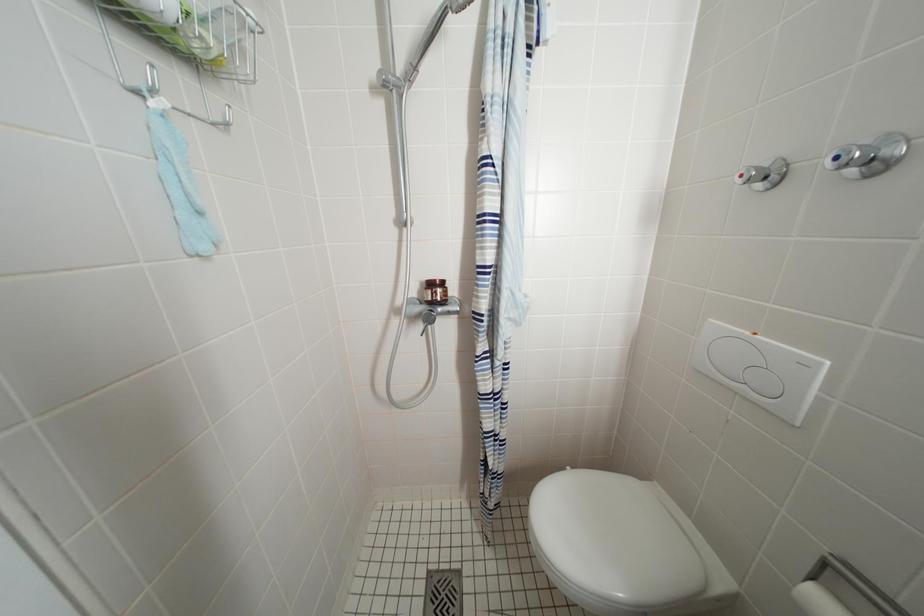
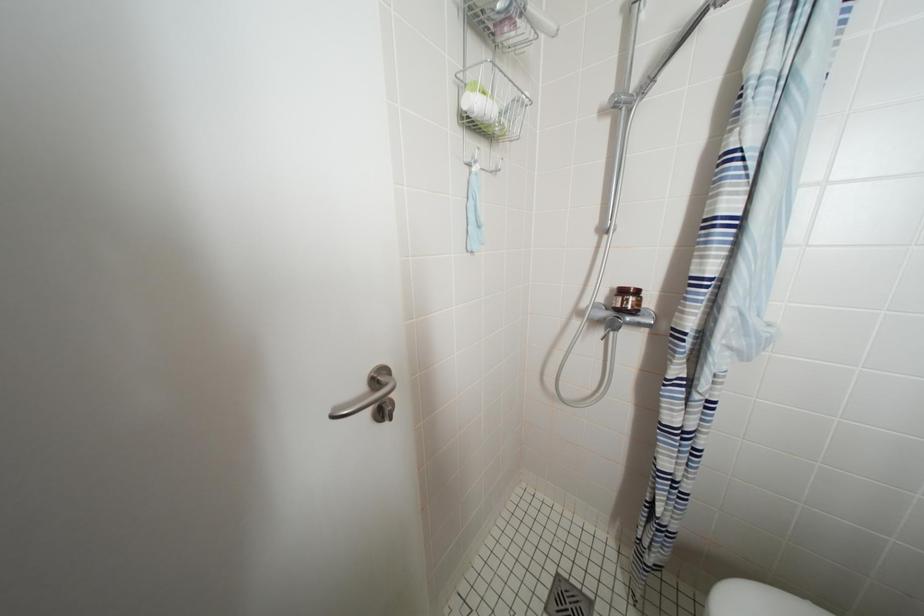
Question: The camera is either moving clockwise (left) or counter-clockwise (right) around the object. The first image is from the beginning of the video and the second image is from the end. Is the camera moving left or right when shooting the video?

Choices:
 (A) Left
 (B) Right

Answer: (B)